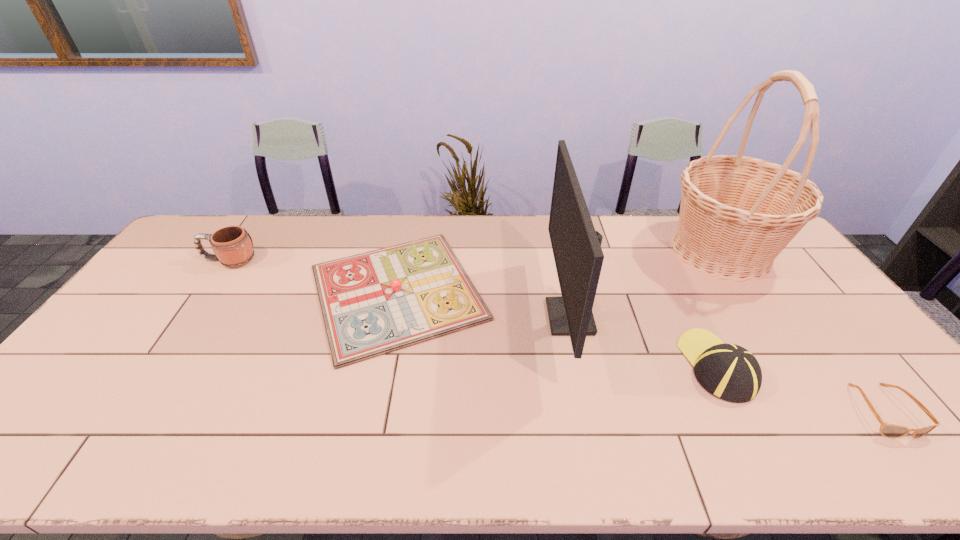
Image resolution: width=960 pixels, height=540 pixels. I want to click on vacant space located on the front-facing side of the computer monitor, so click(520, 317).

You are a GUI agent. You are given a task and a screenshot of the screen. Output one action in this format:
    pyautogui.click(x=<x>, y=<y>)
    Task: Click on the vacant space located 0.070m on the side of the mug with the handle
    This screenshot has height=540, width=960.
    Given the screenshot: What is the action you would take?
    pyautogui.click(x=182, y=260)

Locate an element on the screen. The height and width of the screenshot is (540, 960). vacant space located 0.080m on the side of the mug with the handle is located at coordinates (180, 260).

You are a GUI agent. You are given a task and a screenshot of the screen. Output one action in this format:
    pyautogui.click(x=<x>, y=<y>)
    Task: Click on the vacant region located on the side of the mug with the handle
    
    Given the screenshot: What is the action you would take?
    pyautogui.click(x=182, y=260)

Where is `vacant region located 0.170m with the brim of the baseball cap facing forward`? The height and width of the screenshot is (540, 960). vacant region located 0.170m with the brim of the baseball cap facing forward is located at coordinates (680, 292).

Locate an element on the screen. This screenshot has height=540, width=960. vacant space located with the brim of the baseball cap facing forward is located at coordinates (688, 308).

Find the location of a particular element. vacant point located with the brim of the baseball cap facing forward is located at coordinates (669, 271).

The image size is (960, 540). I want to click on vacant space located on the front of the second object from left to right, so (x=365, y=446).

Where is `basket located in the far edge section of the desktop`? basket located in the far edge section of the desktop is located at coordinates (737, 213).

This screenshot has width=960, height=540. What are the coordinates of `mug that is at the far edge` in the screenshot? It's located at (232, 245).